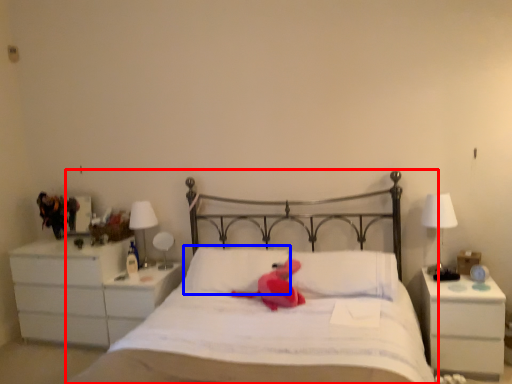
Question: Among these objects, which one is nearest to the camera, bed (highlighted by a red box) or pillow (highlighted by a blue box)?

Choices:
 (A) bed
 (B) pillow

Answer: (A)